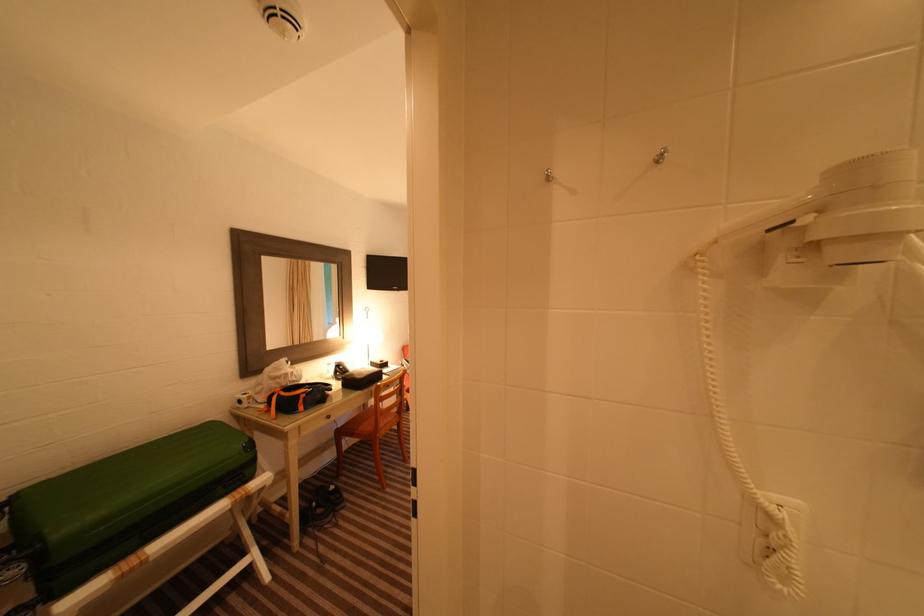
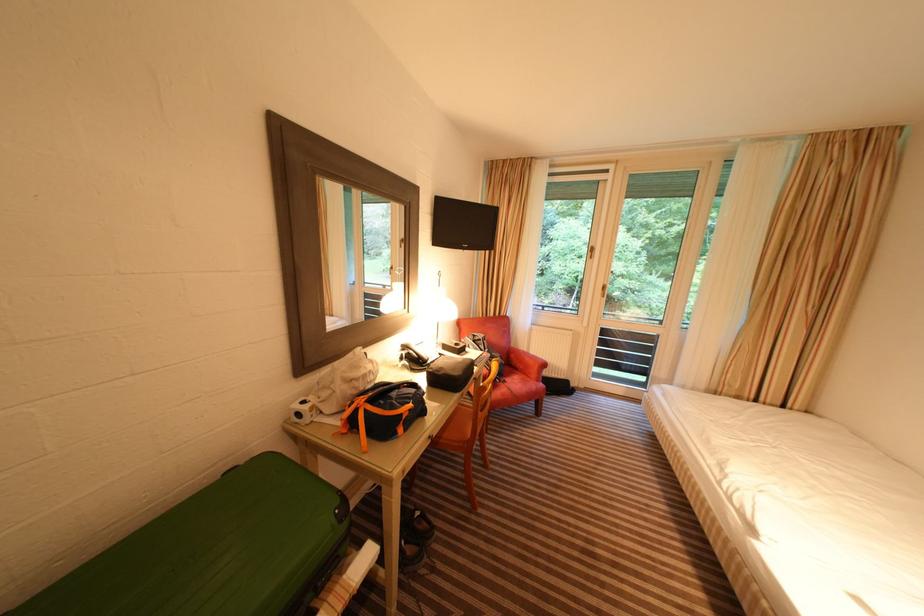
Where in the second image is the point corresponding to [359,377] from the first image?

(447, 371)